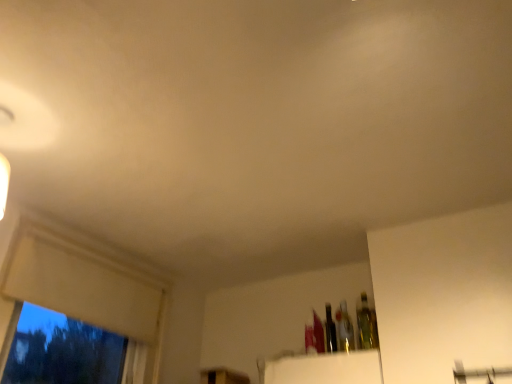
Question: Is the position of shiny metallic bottle at upper right, the first bottle from the left, more distant than that of translucent glass bottle at upper right, which ranks as the 1th bottle in right-to-left order?

Choices:
 (A) yes
 (B) no

Answer: (A)

Question: Is shiny metallic bottle at upper right, the first bottle from the left, completely or partially outside of translucent glass bottle at upper right, which ranks as the 1th bottle in right-to-left order?

Choices:
 (A) yes
 (B) no

Answer: (A)

Question: Are shiny metallic bottle at upper right, the first bottle from the left, and translucent glass bottle at upper right, which ranks as the 1th bottle in right-to-left order, located far from each other?

Choices:
 (A) yes
 (B) no

Answer: (B)

Question: Does shiny metallic bottle at upper right, the first bottle from the left, appear on the right side of translucent glass bottle at upper right, which ranks as the 1th bottle in right-to-left order?

Choices:
 (A) yes
 (B) no

Answer: (B)

Question: Does shiny metallic bottle at upper right, the first bottle from the left, have a lesser height compared to translucent glass bottle at upper right, which ranks as the 1th bottle in right-to-left order?

Choices:
 (A) yes
 (B) no

Answer: (B)

Question: Is shiny metallic bottle at upper right, the first bottle from the left, at the left side of translucent glass bottle at upper right, which ranks as the 1th bottle in right-to-left order?

Choices:
 (A) no
 (B) yes

Answer: (B)

Question: Is translucent glass bottle at center, which appears as the 2th bottle when viewed from the right, positioned in front of shiny metallic bottle at upper right, placed as the 3th bottle when sorted from right to left?

Choices:
 (A) yes
 (B) no

Answer: (A)

Question: From the image's perspective, is translucent glass bottle at center, which is counted as the second bottle, starting from the left, on shiny metallic bottle at upper right, the first bottle from the left?

Choices:
 (A) yes
 (B) no

Answer: (A)

Question: Is translucent glass bottle at center, which appears as the 2th bottle when viewed from the right, surrounding shiny metallic bottle at upper right, placed as the 3th bottle when sorted from right to left?

Choices:
 (A) no
 (B) yes

Answer: (A)

Question: Is translucent glass bottle at center, which appears as the 2th bottle when viewed from the right, positioned beyond the bounds of shiny metallic bottle at upper right, placed as the 3th bottle when sorted from right to left?

Choices:
 (A) no
 (B) yes

Answer: (B)

Question: Can you confirm if translucent glass bottle at center, which is counted as the second bottle, starting from the left, is positioned to the right of shiny metallic bottle at upper right, the first bottle from the left?

Choices:
 (A) yes
 (B) no

Answer: (A)

Question: Is translucent glass bottle at center, which is counted as the second bottle, starting from the left, positioned far away from shiny metallic bottle at upper right, the first bottle from the left?

Choices:
 (A) no
 (B) yes

Answer: (A)

Question: Are translucent glass bottle at upper right, the 3th bottle in the left-to-right sequence, and white matte window frame at left far apart?

Choices:
 (A) no
 (B) yes

Answer: (B)